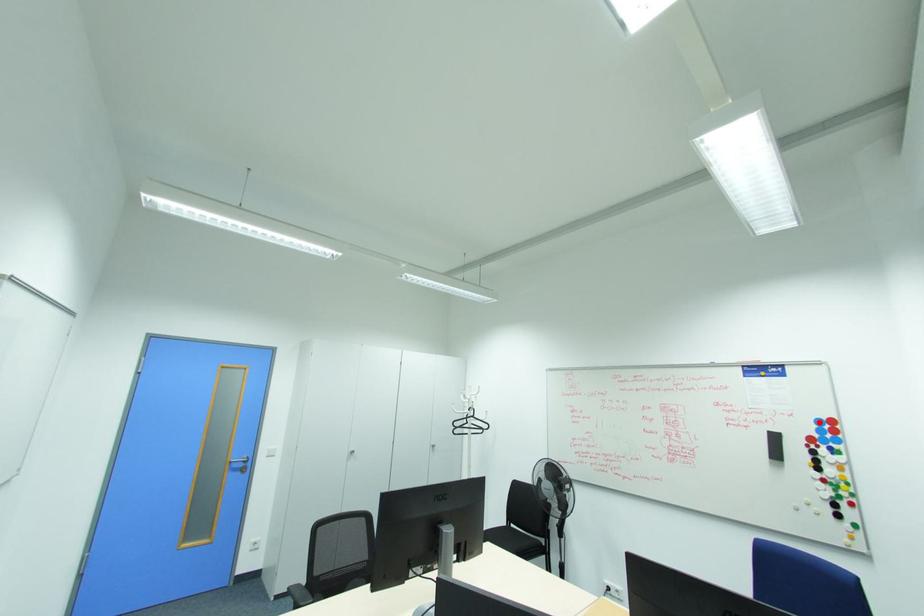
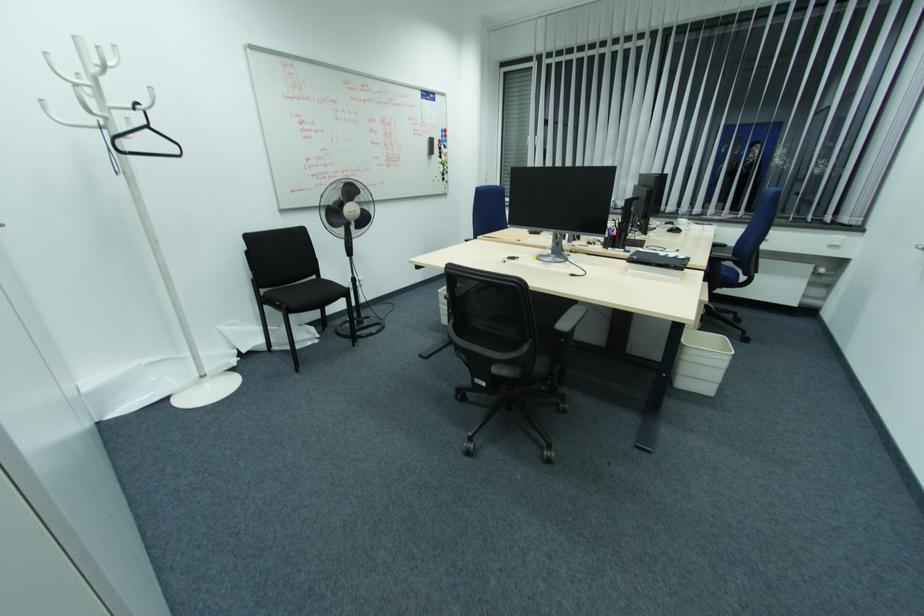
Question: I am providing you with two images of the same scene from different viewpoints. In image1, a red point is highlighted. Considering the same 3D point in image2, which of the following is correct?

Choices:
 (A) It is closer
 (B) It is farther

Answer: (A)